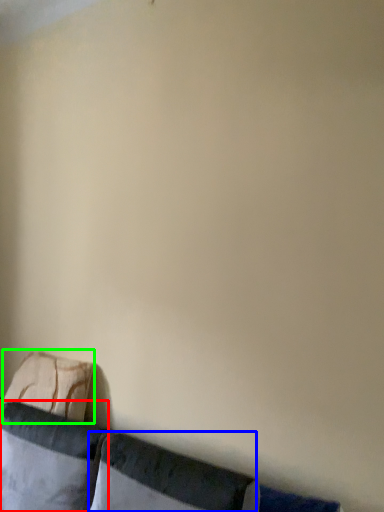
Question: Which object is positioned closest to pillow (highlighted by a red box)? Select from pillow (highlighted by a blue box) and pillow (highlighted by a green box).

Choices:
 (A) pillow
 (B) pillow

Answer: (B)